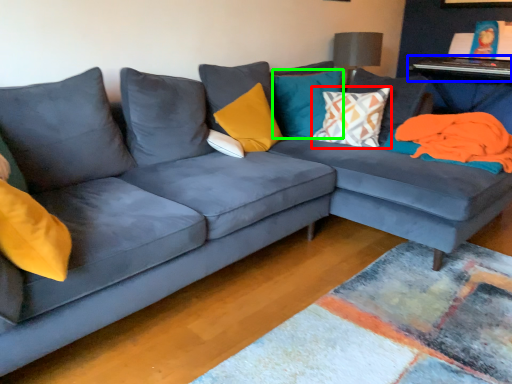
Question: Considering the real-world distances, which object is closest to pillow (highlighted by a red box)? table (highlighted by a blue box) or pillow (highlighted by a green box).

Choices:
 (A) table
 (B) pillow

Answer: (B)